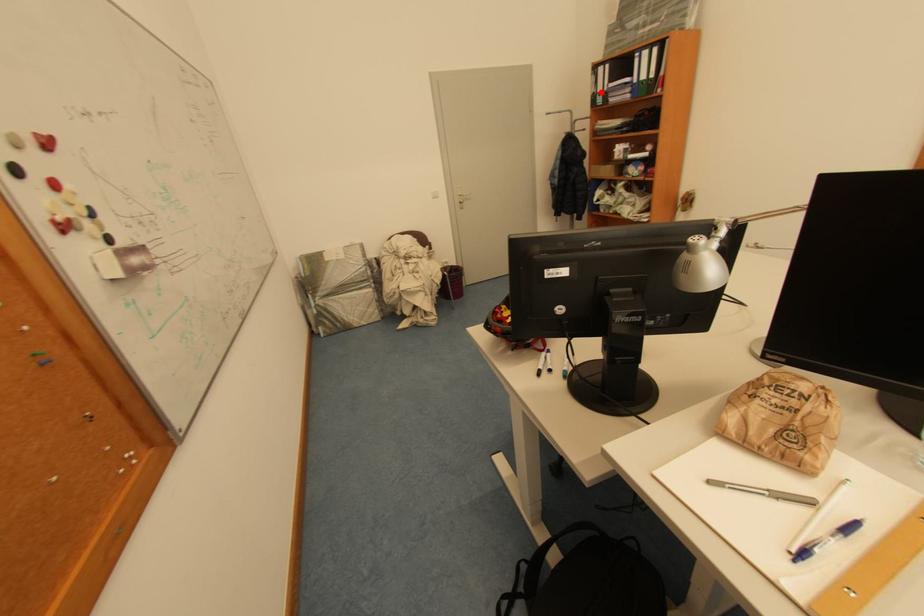
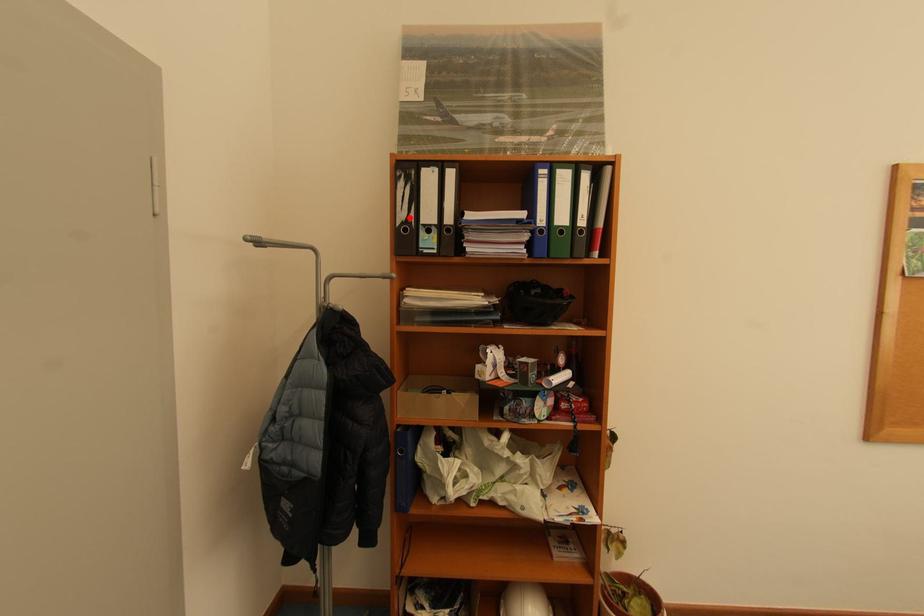
I am providing you with two images of the same scene from different viewpoints. A red point is marked on the first image and another point is marked on the second image. Does the point marked in image1 correspond to the same location as the one in image2?

Yes